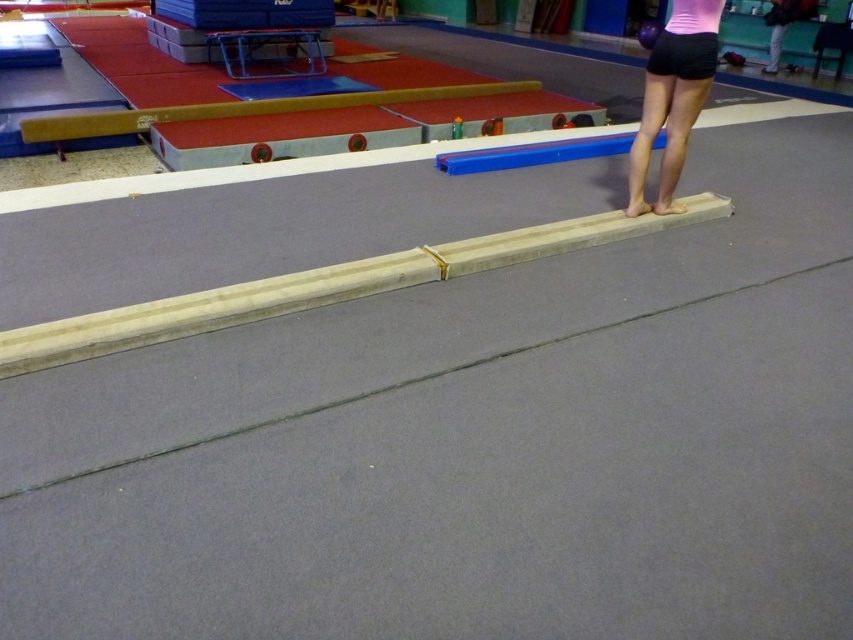
You are a gymnast preparing for a routine. You need to place your black fabric shorts at upper right on the smooth wood beam at center. Will they fit?

The smooth wood beam at center is bigger than the black fabric shorts at upper right, so yes, the shorts will fit on the beam.

You are a gymnast preparing for a routine and notice the black matte shorts at right in your training area. Based on their position, can you estimate where they are located relative to the balance beam?

The black matte shorts at right are located at point 0.153 on the x axis and 0.790 on the y axis, so they are positioned to the right side of the balance beam.

You are a gymnast preparing for a routine and notice two pairs of shorts in your line of sight. The black matte shorts at right and the black fabric shorts at upper right. Which pair has a wider leg opening?

The black matte shorts at right has a wider leg opening than the black fabric shorts at upper right because the black matte shorts at right is wider in width.